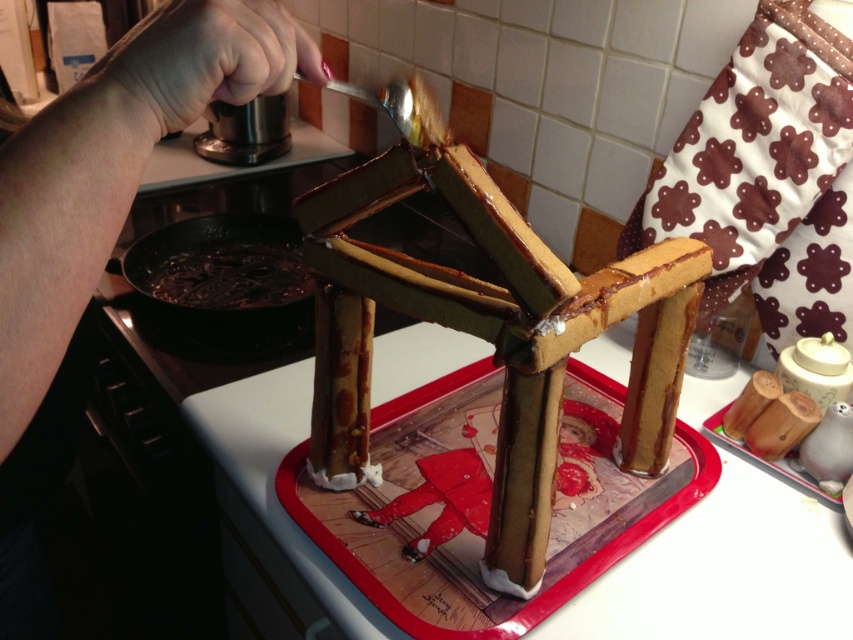
Question: Does smooth chocolate gingerbread house at center have a larger size compared to shiny dark chocolate at lower left?

Choices:
 (A) no
 (B) yes

Answer: (A)

Question: Does smooth chocolate gingerbread house at center appear over shiny dark chocolate at lower left?

Choices:
 (A) no
 (B) yes

Answer: (A)

Question: Which of the following is the farthest from the observer?

Choices:
 (A) (267, 292)
 (B) (381, 508)

Answer: (A)

Question: Which of the following is the farthest from the observer?

Choices:
 (A) shiny dark chocolate at lower left
 (B) smooth chocolate gingerbread house at center

Answer: (A)

Question: Considering the relative positions of smooth chocolate gingerbread house at center and shiny dark chocolate at lower left in the image provided, where is smooth chocolate gingerbread house at center located with respect to shiny dark chocolate at lower left?

Choices:
 (A) above
 (B) below

Answer: (B)